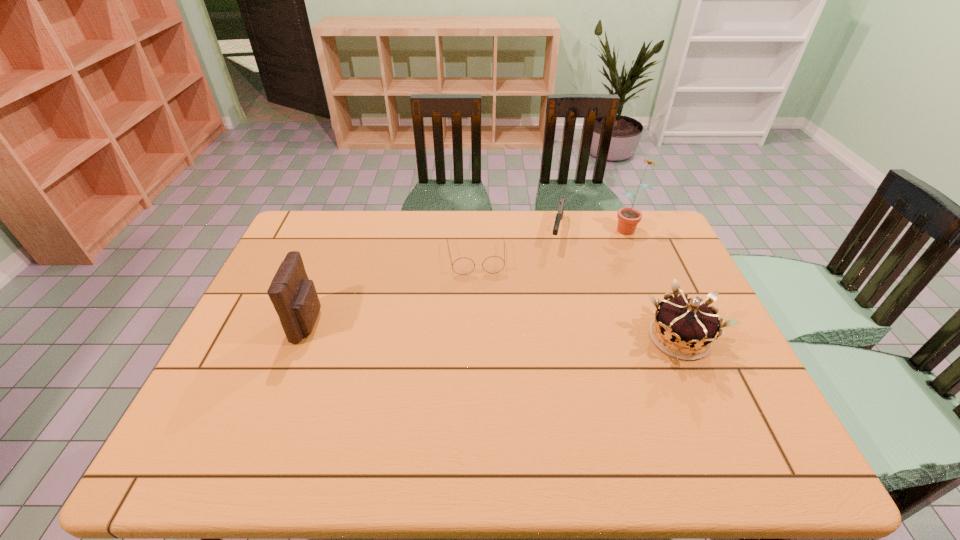
The width and height of the screenshot is (960, 540). I want to click on free space between the tallest object and the third object from left to right, so click(592, 229).

Where is `free space between the crown and the spectacles`? This screenshot has height=540, width=960. free space between the crown and the spectacles is located at coordinates (577, 298).

At what (x,y) coordinates should I click in order to perform the action: click on vacant area that lies between the crown and the sunflower. Please return your answer as a coordinate pair (x, y). The height and width of the screenshot is (540, 960). Looking at the image, I should click on (654, 282).

Identify the location of vacant space that is in between the pouch and the shortest object. coord(392,291).

Find the location of a particular element. free area in between the crown and the third object from left to right is located at coordinates (618, 285).

What are the coordinates of `free spot between the fourth object from right to left and the second tallest object` in the screenshot? It's located at (392, 291).

Locate an element on the screen. The width and height of the screenshot is (960, 540). vacant space that's between the leftmost object and the second shortest object is located at coordinates click(x=433, y=277).

The height and width of the screenshot is (540, 960). Identify the location of free spot between the shortest object and the sunflower. (552, 242).

Where is `blank region between the gun and the sunflower`? The height and width of the screenshot is (540, 960). blank region between the gun and the sunflower is located at coordinates (592, 229).

This screenshot has width=960, height=540. In order to click on empty space between the third object from left to right and the second object from left to right in this screenshot , I will do `click(516, 245)`.